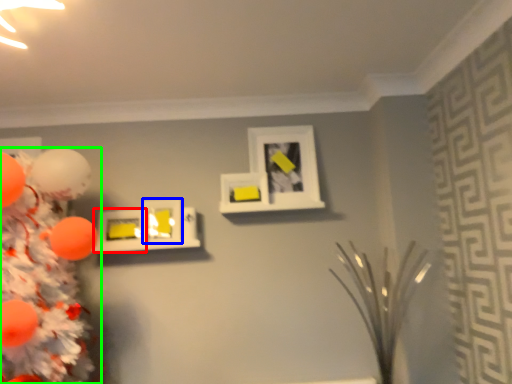
Question: Which object is the closest to the picture frame (highlighted by a red box)? Choose among these: picture frame (highlighted by a blue box) or christmas tree (highlighted by a green box).

Choices:
 (A) picture frame
 (B) christmas tree

Answer: (A)